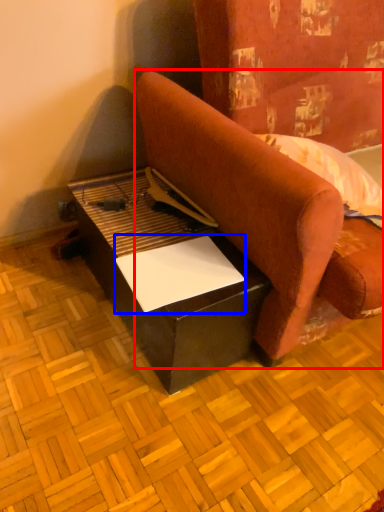
Question: Which object appears farthest to the camera in this image, studio couch (highlighted by a red box) or paper (highlighted by a blue box)?

Choices:
 (A) studio couch
 (B) paper

Answer: (B)